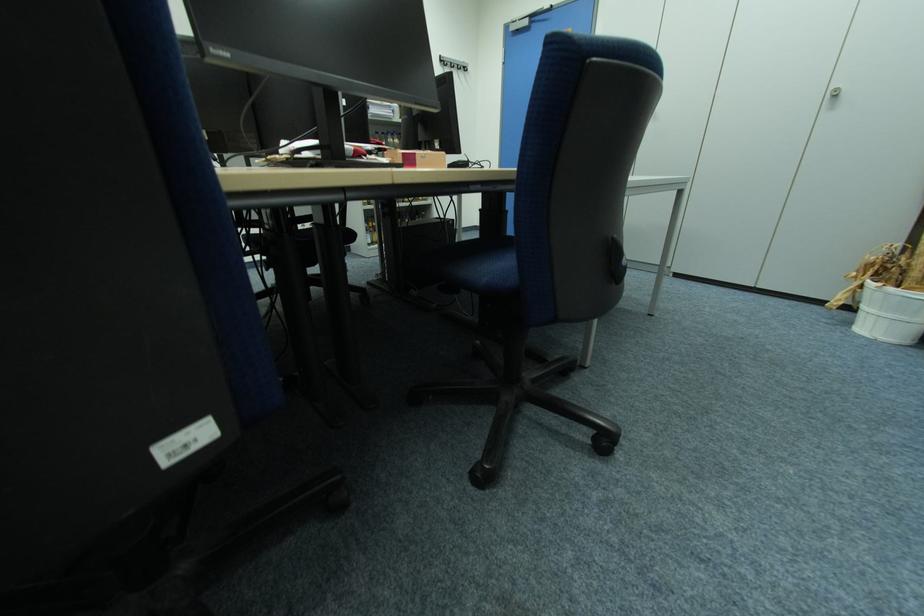
Find the location of a particular element. blue chair sitting surface is located at coordinates (492, 260).